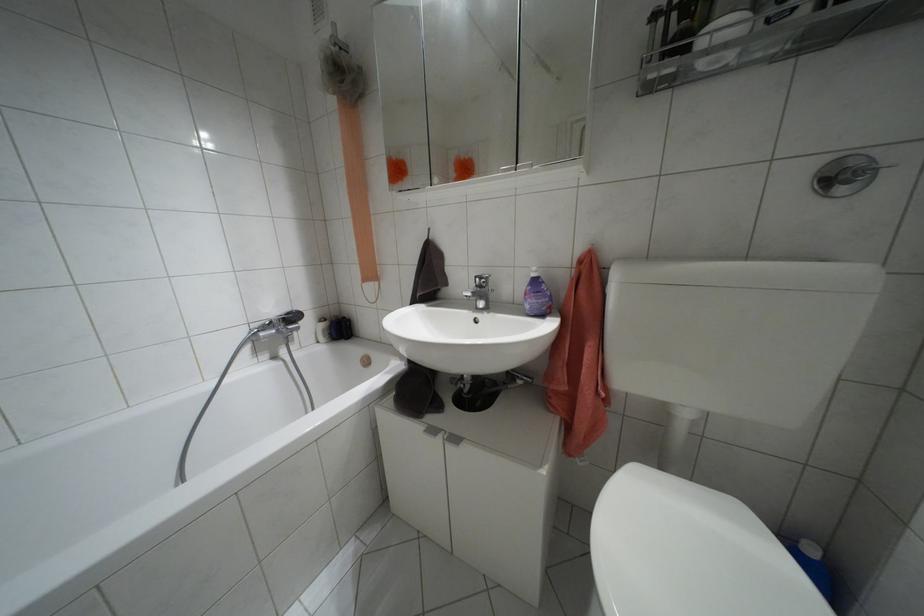
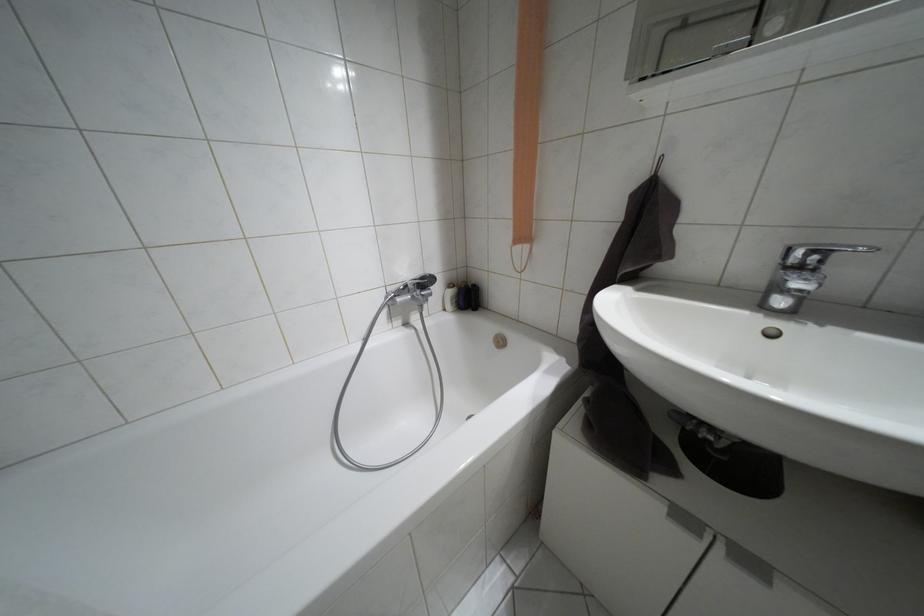
Locate, in the second image, the point that corresponds to (x=321, y=318) in the first image.

(448, 285)